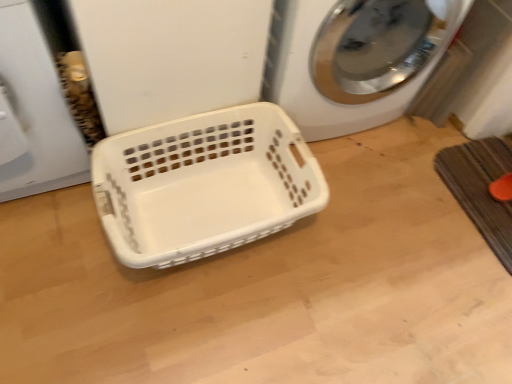
The image size is (512, 384). Describe the element at coordinates (353, 59) in the screenshot. I see `white plastic washing machine at center` at that location.

The image size is (512, 384). What do you see at coordinates (481, 189) in the screenshot? I see `brown textured bath mat at lower right` at bounding box center [481, 189].

In order to click on white plastic basket at center in this screenshot , I will do `click(204, 184)`.

Which is in front, point (151, 126) or point (326, 38)?

The point (151, 126) is closer to the camera.

Is white plastic basket at center positioned beyond the bounds of white plastic washing machine at center?

white plastic basket at center lies outside white plastic washing machine at center's area.

From the image's perspective, is white plastic basket at center located above white plastic washing machine at center?

Actually, white plastic basket at center appears below white plastic washing machine at center in the image.

Between white plastic washing machine at center and white plastic basket at center, which one has smaller width?

white plastic basket at center is thinner.

Is white plastic washing machine at center shorter than white plastic basket at center?

No.

Is white plastic washing machine at center far away from white plastic basket at center?

That's not correct — white plastic washing machine at center is a little close to white plastic basket at center.

Could you tell me if white plastic washing machine at center is turned towards brown textured bath mat at lower right?

No, white plastic washing machine at center is not aimed at brown textured bath mat at lower right.

How distant is white plastic washing machine at center from brown textured bath mat at lower right?

white plastic washing machine at center and brown textured bath mat at lower right are 19.74 inches apart from each other.

Does white plastic washing machine at center have a smaller size compared to brown textured bath mat at lower right?

Incorrect, white plastic washing machine at center is not smaller in size than brown textured bath mat at lower right.

Which object is wider, white plastic washing machine at center or brown textured bath mat at lower right?

With larger width is white plastic washing machine at center.

Can you confirm if white plastic basket at center is wider than brown textured bath mat at lower right?

Correct, the width of white plastic basket at center exceeds that of brown textured bath mat at lower right.

Is white plastic basket at center touching brown textured bath mat at lower right?

white plastic basket at center and brown textured bath mat at lower right are clearly separated.

Is white plastic basket at center positioned before brown textured bath mat at lower right?

That is True.

Is white plastic basket at center at the right side of brown textured bath mat at lower right?

Incorrect, white plastic basket at center is not on the right side of brown textured bath mat at lower right.

From the image's perspective, which is above, brown textured bath mat at lower right or white plastic washing machine at center?

white plastic washing machine at center is shown above in the image.

Considering the sizes of brown textured bath mat at lower right and white plastic washing machine at center in the image, is brown textured bath mat at lower right wider or thinner than white plastic washing machine at center?

Clearly, brown textured bath mat at lower right has less width compared to white plastic washing machine at center.

Is brown textured bath mat at lower right positioned far away from white plastic washing machine at center?

They are positioned close to each other.

Who is shorter, brown textured bath mat at lower right or white plastic washing machine at center?

brown textured bath mat at lower right.

From the image's perspective, is brown textured bath mat at lower right positioned above or below white plastic basket at center?

Clearly, from the image's perspective, brown textured bath mat at lower right is above white plastic basket at center.

Would you say brown textured bath mat at lower right is to the left or to the right of white plastic basket at center in the picture?

In the image, brown textured bath mat at lower right appears on the right side of white plastic basket at center.

Does point (458, 164) come farther from viewer compared to point (158, 223)?

Yes, it is.

Can you see brown textured bath mat at lower right touching white plastic basket at center?

No.

The height and width of the screenshot is (384, 512). Identify the location of basket that is in front of the white plastic washing machine at center. (204, 184).

Locate an element on the screen. The image size is (512, 384). basket that is below the white plastic washing machine at center (from the image's perspective) is located at coordinates (204, 184).

Estimate the real-world distances between objects in this image. Which object is closer to white plastic washing machine at center, brown textured bath mat at lower right or white plastic basket at center?

Based on the image, white plastic basket at center appears to be nearer to white plastic washing machine at center.

Considering their positions, is brown textured bath mat at lower right positioned further to white plastic basket at center than white plastic washing machine at center?

Among the two, brown textured bath mat at lower right is located further to white plastic basket at center.

From the image, which object appears to be nearer to brown textured bath mat at lower right, white plastic basket at center or white plastic washing machine at center?

The object closer to brown textured bath mat at lower right is white plastic washing machine at center.

From the image, which object appears to be nearer to white plastic washing machine at center, white plastic basket at center or brown textured bath mat at lower right?

white plastic basket at center.

Estimate the real-world distances between objects in this image. Which object is further from white plastic basket at center, white plastic washing machine at center or brown textured bath mat at lower right?

brown textured bath mat at lower right is positioned further to the anchor white plastic basket at center.

When comparing their distances from brown textured bath mat at lower right, does white plastic washing machine at center or white plastic basket at center seem further?

The object further to brown textured bath mat at lower right is white plastic basket at center.

Image resolution: width=512 pixels, height=384 pixels. I want to click on washing machine between white plastic basket at center and brown textured bath mat at lower right from left to right, so click(x=353, y=59).